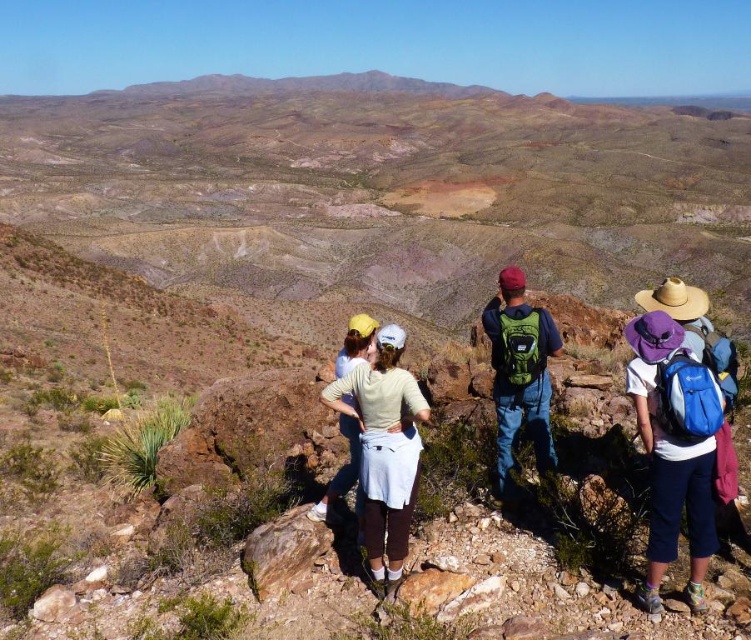
From the picture: You are a photographer positioned at the point labeled as point (385, 449) in the image. You want to capture a photo of the hikers while ensuring the white fabric skirt at center is visible in the frame. Which direction should you move to include both the hikers and the white fabric skirt at center in your shot?

The point (385, 449) corresponds to the white fabric skirt at center. To include both the hikers and the white fabric skirt at center in the photo, you should move backward to widen your field of view, ensuring both elements are in frame.

You are a photographer positioned at the center of the rocky outcrop. You want to capture a photo of the blue fabric backpack at right and the light blue denim jeans at center. Which object should you focus on first if you want to include both in the frame without moving the camera?

The blue fabric backpack at right is below the light blue denim jeans at center, so you should focus on the light blue denim jeans at center first to ensure both are in the frame.

You are a photographer positioned at the edge of the rocky outcrop. You want to capture a photo that includes both the blue fabric backpack at right and the light blue denim jeans at center. Based on their positions, will the backpack appear closer to the camera in the photo?

The blue fabric backpack at right is in front of the light blue denim jeans at center, so in the photo, the backpack will appear closer to the camera than the jeans.